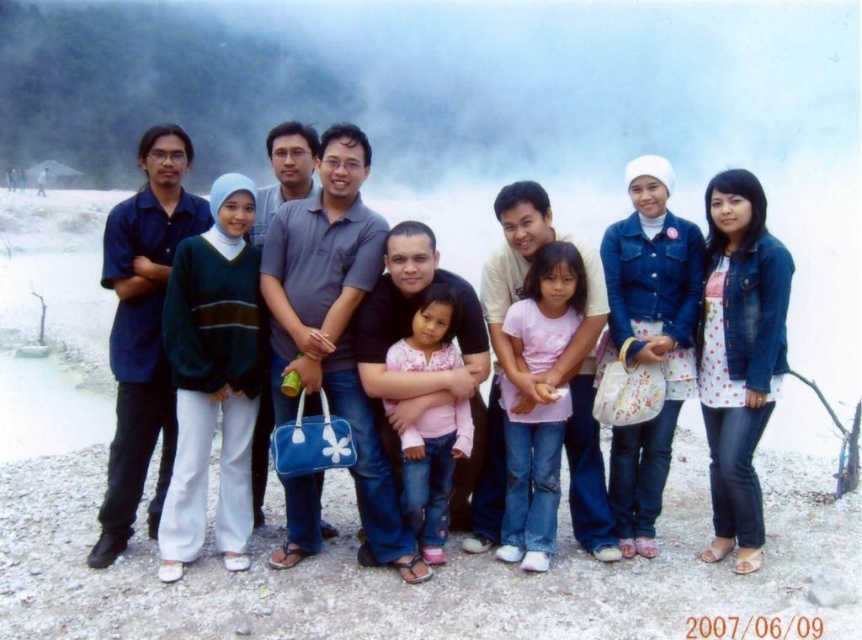
Question: Which is nearer to the matte black shirt at center?

Choices:
 (A) pink matte shirt at center
 (B) pink fabric shirt at center

Answer: (B)

Question: Does matte black shirt at center have a larger size compared to pink matte shirt at center?

Choices:
 (A) no
 (B) yes

Answer: (B)

Question: Does matte black shirt at center appear on the left side of pink fabric shirt at center?

Choices:
 (A) yes
 (B) no

Answer: (A)

Question: Which point is closer to the camera?

Choices:
 (A) (358, 193)
 (B) (436, 452)
 (C) (531, 568)

Answer: (C)

Question: Which is farther from the matte black shirt at center?

Choices:
 (A) pink fabric shirt at center
 (B) pink matte shirt at center

Answer: (B)

Question: Is pink matte shirt at center to the left of pink fabric shirt at center from the viewer's perspective?

Choices:
 (A) no
 (B) yes

Answer: (A)